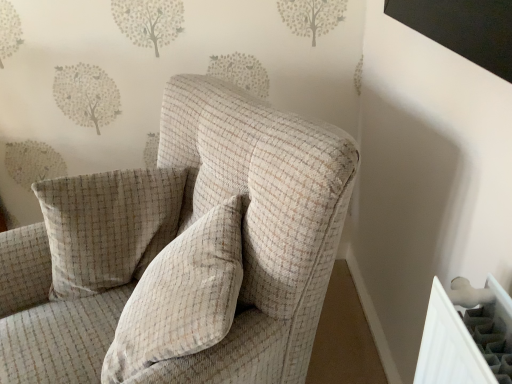
Measure the distance between beige checkered pillow at center, the second pillow from the front, and camera.

beige checkered pillow at center, the second pillow from the front, is 1.07 meters away from camera.

This screenshot has width=512, height=384. In order to click on beige checkered pillow at center, which ranks as the 1th pillow in back-to-front order in this screenshot , I will do `click(106, 226)`.

Describe the element at coordinates (182, 296) in the screenshot. The image size is (512, 384). I see `beige checkered pillow at center, the second pillow when ordered from back to front` at that location.

I want to click on beige checkered armchair at center, so click(182, 253).

Locate an element on the screen. The width and height of the screenshot is (512, 384). beige checkered pillow at center, which ranks as the 1th pillow in back-to-front order is located at coordinates (106, 226).

Is beige checkered pillow at center, the second pillow from the front, turned away from beige checkered armchair at center?

Correct, beige checkered pillow at center, the second pillow from the front, is looking away from beige checkered armchair at center.

Would you say beige checkered pillow at center, the second pillow from the front, is inside or outside beige checkered armchair at center?

The correct answer is: inside.

From the image's perspective, who appears lower, beige checkered pillow at center, which ranks as the 1th pillow in back-to-front order, or beige checkered armchair at center?

From the image's view, beige checkered armchair at center is below.

Who is smaller, beige checkered pillow at center, the second pillow from the front, or beige checkered armchair at center?

beige checkered pillow at center, the second pillow from the front, is smaller.

Considering the relative sizes of beige checkered pillow at center, the second pillow when ordered from back to front, and beige checkered pillow at center, which ranks as the 1th pillow in back-to-front order, in the image provided, is beige checkered pillow at center, the second pillow when ordered from back to front, shorter than beige checkered pillow at center, which ranks as the 1th pillow in back-to-front order,?

Correct, beige checkered pillow at center, the second pillow when ordered from back to front, is not as tall as beige checkered pillow at center, which ranks as the 1th pillow in back-to-front order.

Is beige checkered pillow at center, the second pillow when ordered from back to front, spatially inside beige checkered pillow at center, the second pillow from the front, or outside of it?

beige checkered pillow at center, the second pillow when ordered from back to front, is not enclosed by beige checkered pillow at center, the second pillow from the front.

What's the angular difference between beige checkered pillow at center, the second pillow when ordered from back to front, and beige checkered pillow at center, which ranks as the 1th pillow in back-to-front order,'s facing directions?

The angle between the facing direction of beige checkered pillow at center, the second pillow when ordered from back to front, and the facing direction of beige checkered pillow at center, which ranks as the 1th pillow in back-to-front order, is 112 degrees.

Is beige checkered pillow at center, the second pillow when ordered from back to front, oriented towards beige checkered pillow at center, the second pillow from the front?

Yes.

From their relative heights in the image, would you say beige checkered armchair at center is taller or shorter than beige checkered pillow at center, the second pillow from the front?

Clearly, beige checkered armchair at center is taller compared to beige checkered pillow at center, the second pillow from the front.

From a real-world perspective, does beige checkered armchair at center stand above beige checkered pillow at center, the second pillow from the front?

Incorrect, from a real-world perspective, beige checkered armchair at center is lower than beige checkered pillow at center, the second pillow from the front.

Is beige checkered armchair at center in front of or behind beige checkered pillow at center, which ranks as the 1th pillow in back-to-front order, in the image?

beige checkered armchair at center is positioned closer to the viewer than beige checkered pillow at center, which ranks as the 1th pillow in back-to-front order.

Is beige checkered armchair at center positioned with its back to beige checkered pillow at center, the second pillow from the front?

Yes, beige checkered armchair at center's orientation is away from beige checkered pillow at center, the second pillow from the front.

Based on the photo, can we say beige checkered armchair at center lies outside beige checkered pillow at center, the 1th pillow positioned from the front?

That's correct, beige checkered armchair at center is outside of beige checkered pillow at center, the 1th pillow positioned from the front.

Between beige checkered armchair at center and beige checkered pillow at center, the 1th pillow positioned from the front, which one has smaller size?

beige checkered pillow at center, the 1th pillow positioned from the front.

Which object is further away from the camera, beige checkered armchair at center or beige checkered pillow at center, the second pillow when ordered from back to front?

beige checkered pillow at center, the second pillow when ordered from back to front, is further away from the camera.

In the scene shown: Can you tell me how much beige checkered armchair at center and beige checkered pillow at center, the second pillow when ordered from back to front, differ in facing direction?

The angular difference between beige checkered armchair at center and beige checkered pillow at center, the second pillow when ordered from back to front, is 38.4 degrees.

Locate an element on the screen. Image resolution: width=512 pixels, height=384 pixels. pillow below the beige checkered pillow at center, the second pillow from the front (from the image's perspective) is located at coordinates (182, 296).

Is beige checkered pillow at center, which ranks as the 1th pillow in back-to-front order, wider than beige checkered pillow at center, the 1th pillow positioned from the front?

Incorrect, the width of beige checkered pillow at center, which ranks as the 1th pillow in back-to-front order, does not surpass that of beige checkered pillow at center, the 1th pillow positioned from the front.

Between beige checkered pillow at center, which ranks as the 1th pillow in back-to-front order, and beige checkered pillow at center, the 1th pillow positioned from the front, which one has less height?

beige checkered pillow at center, the 1th pillow positioned from the front.

Is beige checkered pillow at center, the second pillow from the front, oriented away from beige checkered pillow at center, the second pillow when ordered from back to front?

No.

Is beige checkered pillow at center, the 1th pillow positioned from the front, in front of or behind beige checkered armchair at center in the image?

beige checkered pillow at center, the 1th pillow positioned from the front, is positioned farther from the viewer than beige checkered armchair at center.

From the image's perspective, which is above, beige checkered pillow at center, the second pillow when ordered from back to front, or beige checkered armchair at center?

beige checkered pillow at center, the second pillow when ordered from back to front, appears higher in the image.

Considering the sizes of objects beige checkered pillow at center, the 1th pillow positioned from the front, and beige checkered armchair at center in the image provided, who is thinner, beige checkered pillow at center, the 1th pillow positioned from the front, or beige checkered armchair at center?

beige checkered pillow at center, the 1th pillow positioned from the front, is thinner.

This screenshot has width=512, height=384. Identify the location of pillow on the right of beige checkered armchair at center. (182, 296).

Find the location of a particular element. This screenshot has height=384, width=512. the 1st pillow above the beige checkered armchair at center (from a real-world perspective) is located at coordinates (106, 226).

The height and width of the screenshot is (384, 512). What are the coordinates of `pillow to the left of beige checkered pillow at center, the second pillow when ordered from back to front` in the screenshot? It's located at (106, 226).

Estimate the real-world distances between objects in this image. Which object is further from beige checkered pillow at center, the 1th pillow positioned from the front, beige checkered pillow at center, which ranks as the 1th pillow in back-to-front order, or beige checkered armchair at center?

beige checkered pillow at center, which ranks as the 1th pillow in back-to-front order.

Based on their spatial positions, is beige checkered armchair at center or beige checkered pillow at center, the second pillow from the front, further from beige checkered pillow at center, the second pillow when ordered from back to front?

beige checkered pillow at center, the second pillow from the front, lies further to beige checkered pillow at center, the second pillow when ordered from back to front, than the other object.

Estimate the real-world distances between objects in this image. Which object is further from beige checkered armchair at center, beige checkered pillow at center, which ranks as the 1th pillow in back-to-front order, or beige checkered pillow at center, the second pillow when ordered from back to front?

beige checkered pillow at center, which ranks as the 1th pillow in back-to-front order.

When comparing their distances from beige checkered pillow at center, the second pillow from the front, does beige checkered pillow at center, the 1th pillow positioned from the front, or beige checkered armchair at center seem further?

The object further to beige checkered pillow at center, the second pillow from the front, is beige checkered pillow at center, the 1th pillow positioned from the front.

Estimate the real-world distances between objects in this image. Which object is further from beige checkered armchair at center, beige checkered pillow at center, the 1th pillow positioned from the front, or beige checkered pillow at center, the second pillow from the front?

Based on the image, beige checkered pillow at center, the second pillow from the front, appears to be further to beige checkered armchair at center.

Estimate the real-world distances between objects in this image. Which object is further from beige checkered pillow at center, the second pillow from the front, beige checkered armchair at center or beige checkered pillow at center, the 1th pillow positioned from the front?

Based on the image, beige checkered pillow at center, the 1th pillow positioned from the front, appears to be further to beige checkered pillow at center, the second pillow from the front.

I want to click on pillow between beige checkered armchair at center and beige checkered pillow at center, the second pillow from the front, from front to back, so click(x=182, y=296).